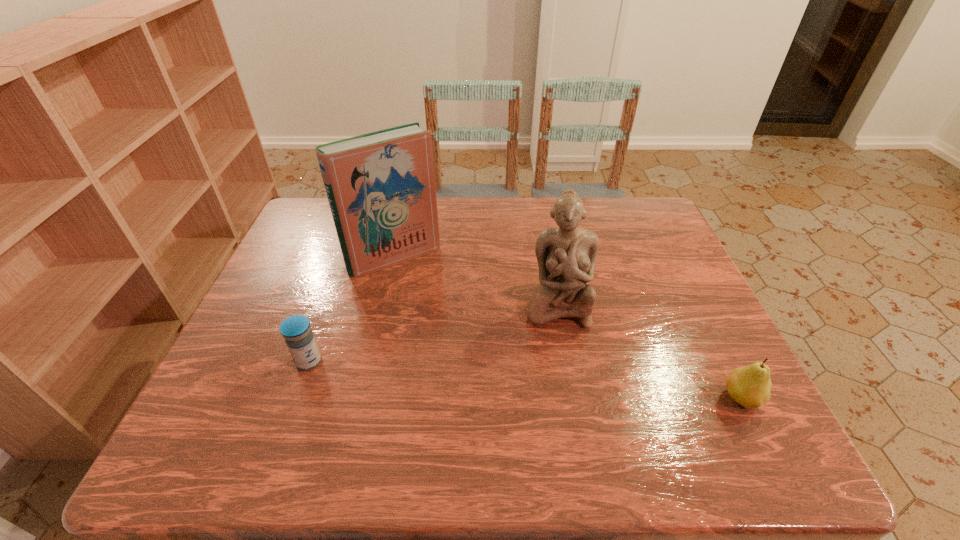
Locate an element on the screen. Image resolution: width=960 pixels, height=540 pixels. free space located 0.350m on the cover of the farthest object is located at coordinates (480, 365).

Locate an element on the screen. The width and height of the screenshot is (960, 540). free space located on the cover of the farthest object is located at coordinates (471, 353).

Locate an element on the screen. The height and width of the screenshot is (540, 960). free location located on the front-facing side of the second farthest object is located at coordinates (561, 383).

You are a GUI agent. You are given a task and a screenshot of the screen. Output one action in this format:
    pyautogui.click(x=<x>, y=<y>)
    Task: Click on the free space located 0.150m on the front-facing side of the second farthest object
    
    Given the screenshot: What is the action you would take?
    pyautogui.click(x=561, y=383)

Find the location of a particular element. The image size is (960, 540). vacant space located 0.210m on the front-facing side of the second farthest object is located at coordinates [562, 408].

Where is `object that is at the far edge`? object that is at the far edge is located at coordinates (380, 186).

In order to click on object situated at the near edge in this screenshot , I will do `click(750, 386)`.

I want to click on object at the left edge, so click(296, 330).

Locate an element on the screen. object at the right edge is located at coordinates (750, 386).

Where is `object present at the near right corner`? object present at the near right corner is located at coordinates (750, 386).